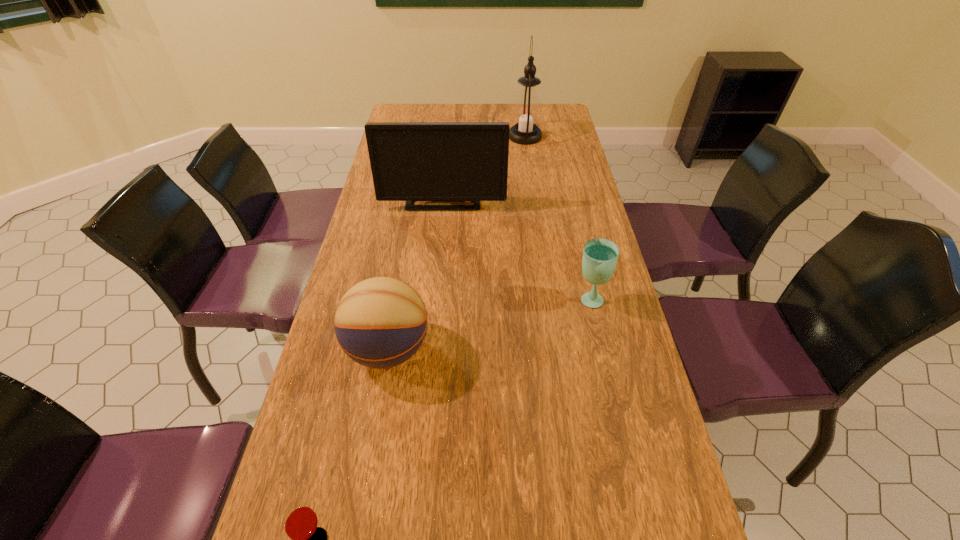
At what (x,y) coordinates should I click in order to perform the action: click on free region that satisfies the following two spatial constraints: 1. on the screen side of the fourth shortest object; 2. on the patterned surface of the second nearest object. Please return your answer as a coordinate pair (x, y). Image resolution: width=960 pixels, height=540 pixels. Looking at the image, I should click on (429, 349).

Where is `vacant space that satisfies the following two spatial constraints: 1. on the front side of the farther glass; 2. on the patterned surface of the basketball`? The image size is (960, 540). vacant space that satisfies the following two spatial constraints: 1. on the front side of the farther glass; 2. on the patterned surface of the basketball is located at coordinates (600, 349).

Where is `blank area in the image that satisfies the following two spatial constraints: 1. on the screen side of the second tallest object; 2. on the patterned surface of the basketball`? The image size is (960, 540). blank area in the image that satisfies the following two spatial constraints: 1. on the screen side of the second tallest object; 2. on the patterned surface of the basketball is located at coordinates (429, 349).

Locate an element on the screen. This screenshot has width=960, height=540. vacant point that satisfies the following two spatial constraints: 1. on the front side of the oil lamp; 2. on the right side of the taller glass is located at coordinates (548, 299).